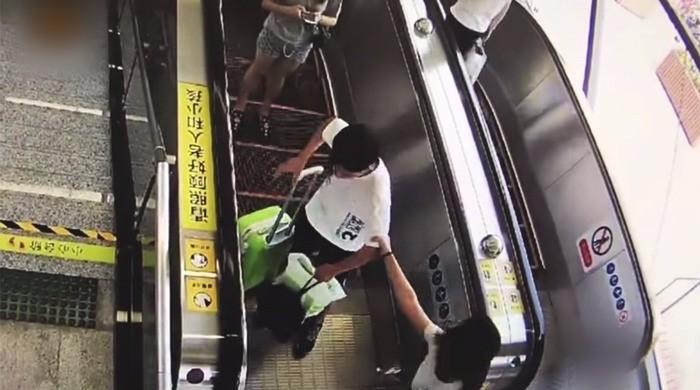
At what (x,y) coordinates should I click in order to perform the action: click on stairway. Please return your answer as a coordinate pair (x, y). This screenshot has height=390, width=700. Looking at the image, I should click on (50, 170).